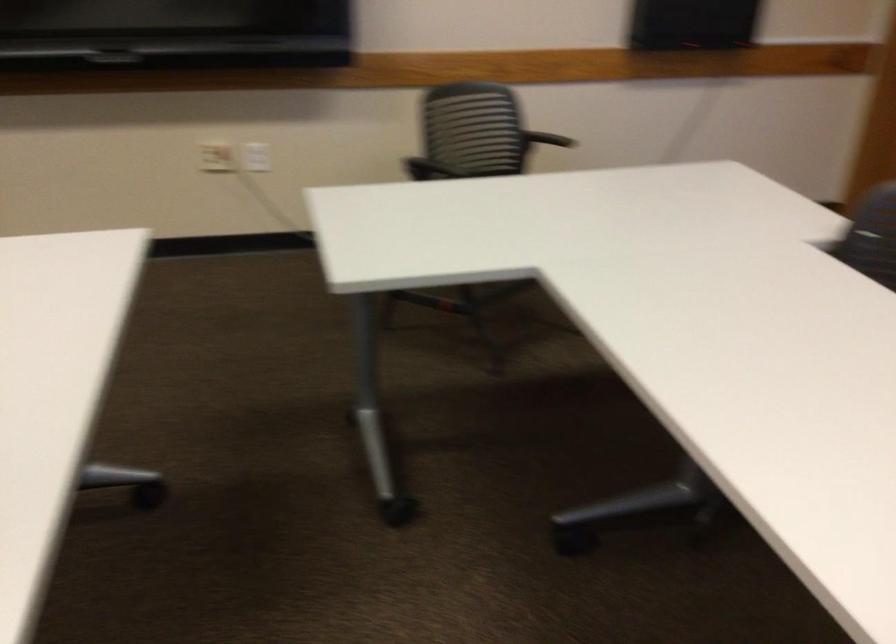
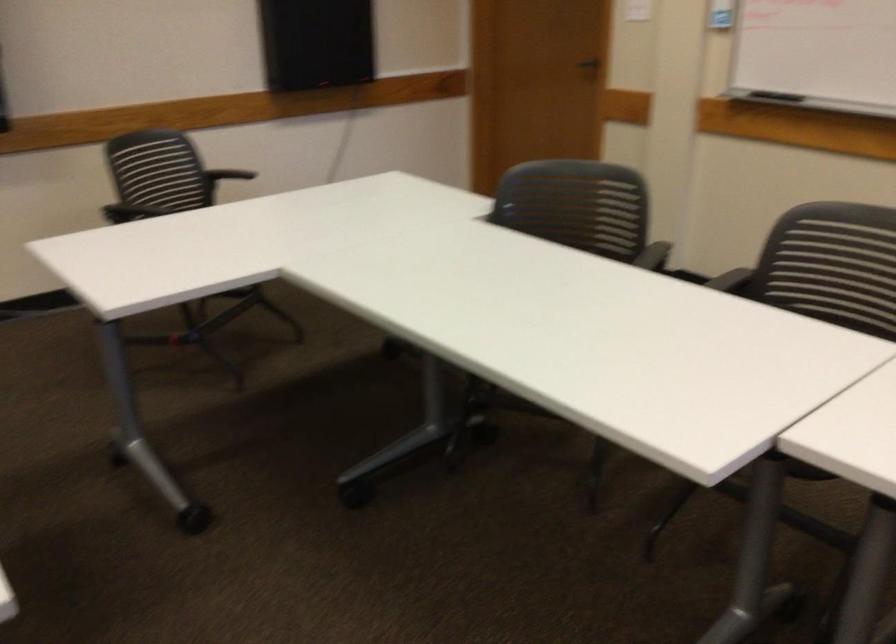
In a continuous first-person perspective shot, in which direction is the camera moving?

The cameraman moved toward left, backward.